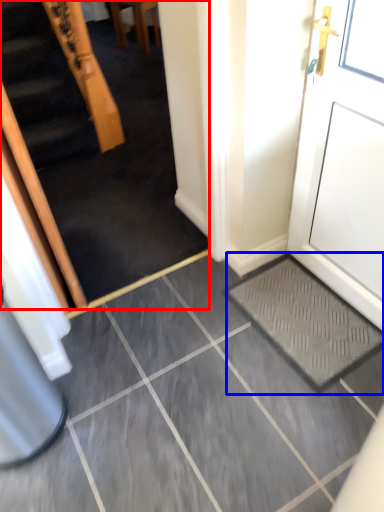
Question: Which of the following is the farthest to the observer, escalator (highlighted by a red box) or doormat (highlighted by a blue box)?

Choices:
 (A) escalator
 (B) doormat

Answer: (B)